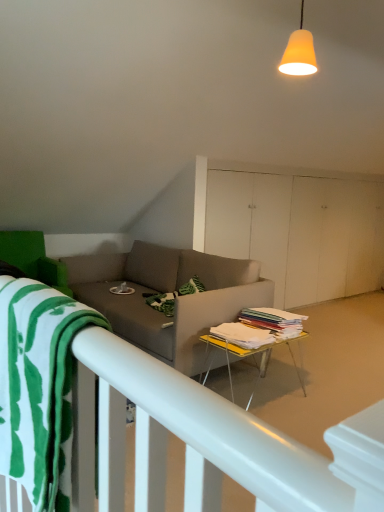
Find the location of a particular element. This screenshot has height=512, width=384. orange matte lampshade at upper center is located at coordinates (299, 52).

The height and width of the screenshot is (512, 384). What are the coordinates of `green cotton beach towel at lower left` in the screenshot? It's located at (39, 388).

This screenshot has height=512, width=384. What do you see at coordinates (208, 441) in the screenshot? I see `white matte bed frame at lower left` at bounding box center [208, 441].

At what (x,y) coordinates should I click in order to perform the action: click on yellow plastic table at center. Please return your answer as a coordinate pair (x, y). The image size is (384, 512). Looking at the image, I should click on (246, 358).

What is the approximate height of yellow plastic table at center?

It is 15.94 inches.

Locate an element on the screen. The image size is (384, 512). orange matte lampshade at upper center is located at coordinates (299, 52).

From a real-world perspective, which is physically above, yellow plastic table at center or orange matte lampshade at upper center?

orange matte lampshade at upper center.

Between yellow plastic table at center and orange matte lampshade at upper center, which one has smaller width?

Thinner between the two is orange matte lampshade at upper center.

Is yellow plastic table at center positioned with its back to orange matte lampshade at upper center?

That's not correct — yellow plastic table at center is not looking away from orange matte lampshade at upper center.

Considering the points (252, 358) and (311, 35), which point is behind, point (252, 358) or point (311, 35)?

Positioned behind is point (252, 358).

Is green cotton beach towel at lower left positioned beyond the bounds of yellow plastic table at center?

Indeed, green cotton beach towel at lower left is completely outside yellow plastic table at center.

Where is `beach towel above the yellow plastic table at center (from a real-world perspective)`? The image size is (384, 512). beach towel above the yellow plastic table at center (from a real-world perspective) is located at coordinates (39, 388).

From a real-world perspective, is green cotton beach towel at lower left positioned under yellow plastic table at center based on gravity?

No.

Considering the sizes of objects green cotton beach towel at lower left and yellow plastic table at center in the image provided, who is thinner, green cotton beach towel at lower left or yellow plastic table at center?

With smaller width is green cotton beach towel at lower left.

Between green cotton beach towel at lower left and orange matte lampshade at upper center, which one has larger width?

Wider between the two is green cotton beach towel at lower left.

Could orange matte lampshade at upper center be considered to be inside green cotton beach towel at lower left?

That's incorrect, orange matte lampshade at upper center is not inside green cotton beach towel at lower left.

Could you tell me if green cotton beach towel at lower left is turned towards orange matte lampshade at upper center?

No, green cotton beach towel at lower left is not oriented towards orange matte lampshade at upper center.

Is green cotton beach towel at lower left taller than orange matte lampshade at upper center?

Yes, green cotton beach towel at lower left is taller than orange matte lampshade at upper center.

From a real-world perspective, is yellow plastic table at center positioned over white matte bed frame at lower left based on gravity?

Correct, in the physical world, yellow plastic table at center is higher than white matte bed frame at lower left.

Can white matte bed frame at lower left be found inside yellow plastic table at center?

No, white matte bed frame at lower left is not inside yellow plastic table at center.

Which point is more distant from viewer, [220,341] or [234,418]?

The point [220,341] is more distant.

Is yellow plastic table at center with white matte bed frame at lower left?

yellow plastic table at center is not next to white matte bed frame at lower left, and they're not touching.

In the scene shown: Is white matte bed frame at lower left touching green cotton beach towel at lower left?

No, white matte bed frame at lower left is not with green cotton beach towel at lower left.

Can green cotton beach towel at lower left be found inside white matte bed frame at lower left?

No, green cotton beach towel at lower left is not a part of white matte bed frame at lower left.

What are the coordinates of `beach towel in front of the white matte bed frame at lower left` in the screenshot? It's located at click(x=39, y=388).

Consider the image. Is white matte bed frame at lower left positioned with its back to green cotton beach towel at lower left?

white matte bed frame at lower left is not turned away from green cotton beach towel at lower left.

I want to click on beach towel above the yellow plastic table at center (from a real-world perspective), so click(39, 388).

Could you tell me if yellow plastic table at center is facing green cotton beach towel at lower left?

No.

From a real-world perspective, which object rests below the other?

yellow plastic table at center, from a real-world perspective.

Is yellow plastic table at center positioned far away from green cotton beach towel at lower left?

That's right, there is a large distance between yellow plastic table at center and green cotton beach towel at lower left.

Considering the positions of objects orange matte lampshade at upper center and green cotton beach towel at lower left in the image provided, who is behind, orange matte lampshade at upper center or green cotton beach towel at lower left?

orange matte lampshade at upper center is further away from the camera.

Identify the location of beach towel in front of the orange matte lampshade at upper center. The height and width of the screenshot is (512, 384). pyautogui.click(x=39, y=388).

From a real-world perspective, is orange matte lampshade at upper center over green cotton beach towel at lower left?

Yes, from a real-world perspective, orange matte lampshade at upper center is on top of green cotton beach towel at lower left.

How different are the orientations of orange matte lampshade at upper center and green cotton beach towel at lower left in degrees?

orange matte lampshade at upper center and green cotton beach towel at lower left are facing 1.33 degrees away from each other.

You are a GUI agent. You are given a task and a screenshot of the screen. Output one action in this format:
    pyautogui.click(x=<x>, y=<y>)
    Task: Click on the table below the orange matte lampshade at upper center (from the image's perspective)
    This screenshot has width=384, height=512.
    Given the screenshot: What is the action you would take?
    pos(246,358)

I want to click on beach towel on the left of the yellow plastic table at center, so click(x=39, y=388).

Which object lies further to the anchor point yellow plastic table at center, green cotton beach towel at lower left or white matte bed frame at lower left?

A: white matte bed frame at lower left is positioned further to the anchor yellow plastic table at center.

Based on their spatial positions, is orange matte lampshade at upper center or white matte bed frame at lower left closer to green cotton beach towel at lower left?

Among the two, white matte bed frame at lower left is located nearer to green cotton beach towel at lower left.

Consider the image. Estimate the real-world distances between objects in this image. Which object is closer to white matte bed frame at lower left, green cotton beach towel at lower left or orange matte lampshade at upper center?

green cotton beach towel at lower left.

Looking at this image, considering their positions, is yellow plastic table at center positioned closer to green cotton beach towel at lower left than orange matte lampshade at upper center?

Among the two, yellow plastic table at center is located nearer to green cotton beach towel at lower left.

Consider the image. From the image, which object appears to be nearer to yellow plastic table at center, green cotton beach towel at lower left or orange matte lampshade at upper center?

green cotton beach towel at lower left.

Considering their positions, is orange matte lampshade at upper center positioned further to yellow plastic table at center than white matte bed frame at lower left?

white matte bed frame at lower left.

Looking at this image, when comparing their distances from white matte bed frame at lower left, does orange matte lampshade at upper center or yellow plastic table at center seem closer?

yellow plastic table at center lies closer to white matte bed frame at lower left than the other object.

Based on their spatial positions, is orange matte lampshade at upper center or yellow plastic table at center closer to green cotton beach towel at lower left?

yellow plastic table at center is positioned closer to the anchor green cotton beach towel at lower left.

Locate an element on the screen. Image resolution: width=384 pixels, height=512 pixels. beach towel between orange matte lampshade at upper center and yellow plastic table at center in the vertical direction is located at coordinates (39, 388).

What are the coordinates of `beach towel between orange matte lampshade at upper center and white matte bed frame at lower left from top to bottom` in the screenshot? It's located at (39, 388).

The height and width of the screenshot is (512, 384). In order to click on bed frame between green cotton beach towel at lower left and yellow plastic table at center in the front-back direction in this screenshot , I will do `click(208, 441)`.

The height and width of the screenshot is (512, 384). I want to click on table between orange matte lampshade at upper center and white matte bed frame at lower left in the vertical direction, so click(246, 358).